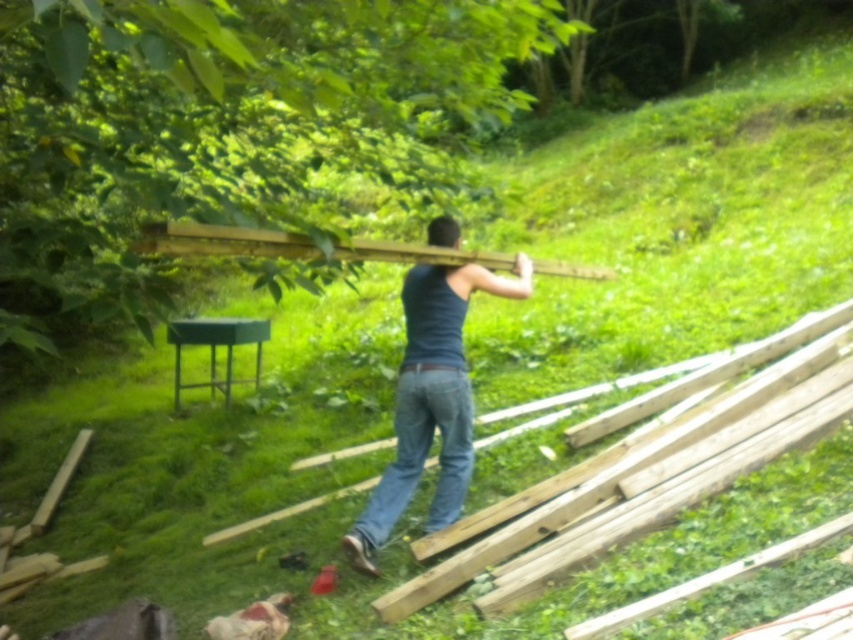
Can you confirm if natural wood at right is wider than wooden plank at upper center?

Yes.

Is natural wood at right further to camera compared to wooden plank at upper center?

Yes, it is.

You are a GUI agent. You are given a task and a screenshot of the screen. Output one action in this format:
    pyautogui.click(x=<x>, y=<y>)
    Task: Click on the natural wood at right
    Image resolution: width=853 pixels, height=640 pixels.
    Given the screenshot: What is the action you would take?
    pyautogui.click(x=647, y=468)

Between point (612, 499) and point (451, 397), which one is positioned behind?

Positioned behind is point (451, 397).

I want to click on natural wood at right, so click(x=647, y=468).

In order to click on natural wood at right in this screenshot , I will do `click(647, 468)`.

At what (x,y) coordinates should I click in order to perform the action: click on natural wood at right. Please return your answer as a coordinate pair (x, y). The image size is (853, 640). Looking at the image, I should click on (647, 468).

Can you confirm if natural wood at right is thinner than jeans at center?

In fact, natural wood at right might be wider than jeans at center.

Does natural wood at right appear over jeans at center?

Indeed, natural wood at right is positioned over jeans at center.

Who is more distant from viewer, (x=569, y=481) or (x=462, y=449)?

The point (x=462, y=449) is more distant.

Find the location of a particular element. The height and width of the screenshot is (640, 853). natural wood at right is located at coordinates (647, 468).